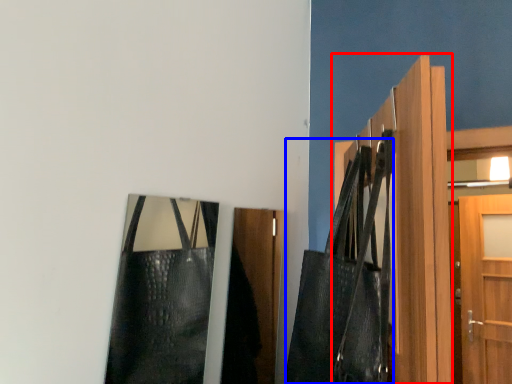
Question: Among these objects, which one is nearest to the camera, door (highlighted by a red box) or shoulder bag (highlighted by a blue box)?

Choices:
 (A) door
 (B) shoulder bag

Answer: (A)